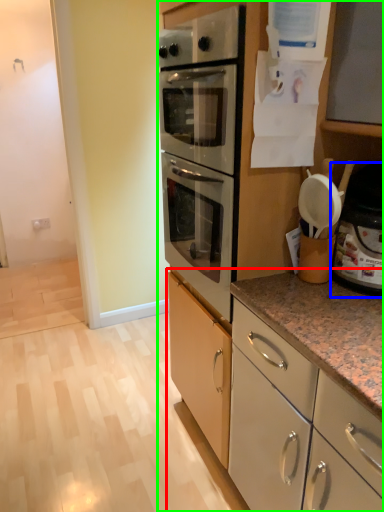
Question: Which object is positioned closest to cabinetry (highlighted by a red box)? Select from appliance (highlighted by a blue box) and cabinetry (highlighted by a green box).

Choices:
 (A) appliance
 (B) cabinetry

Answer: (B)